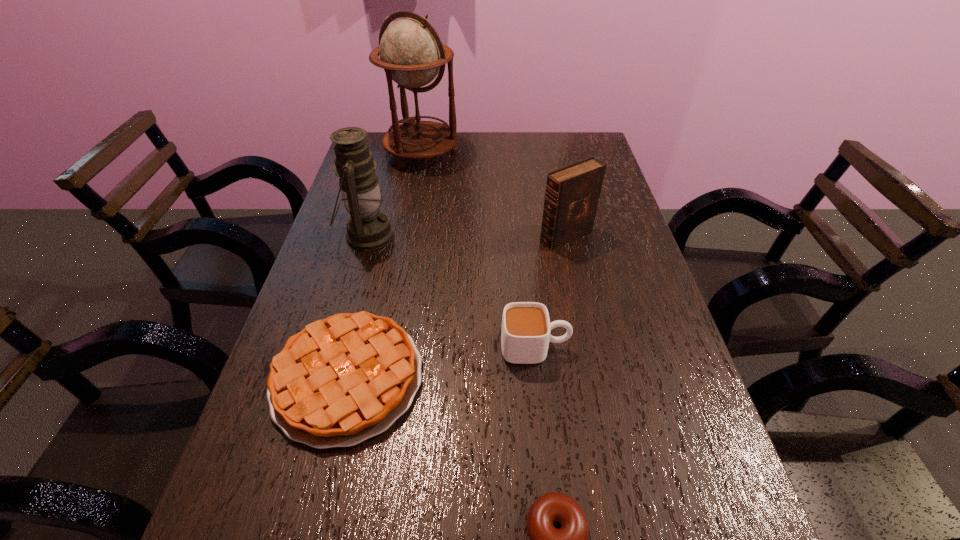
At what (x,y) coordinates should I click in order to perform the action: click on vacant region that satisfies the following two spatial constraints: 1. on the back side of the second shortest object; 2. on the left side of the Bible. Please return your answer as a coordinate pair (x, y). Image resolution: width=960 pixels, height=540 pixels. Looking at the image, I should click on (382, 237).